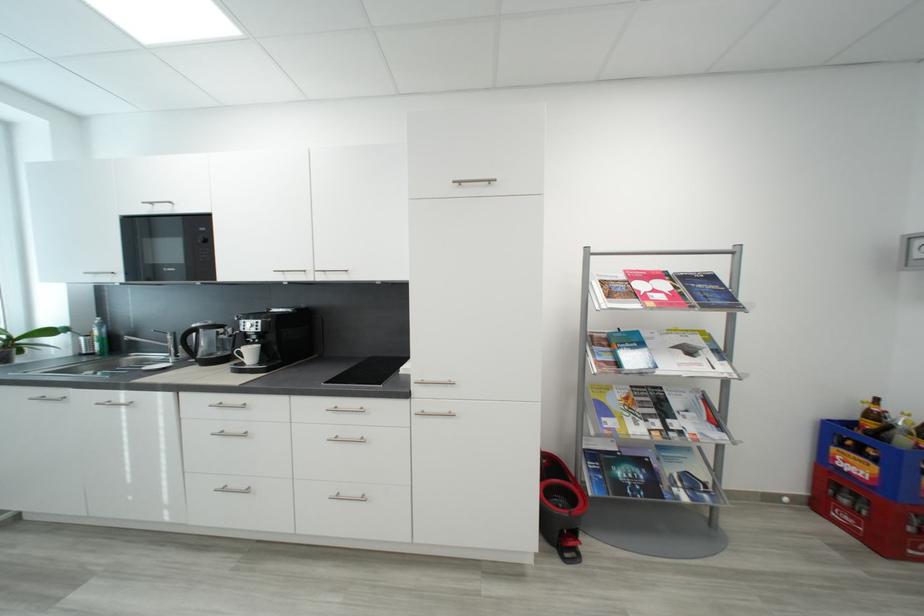
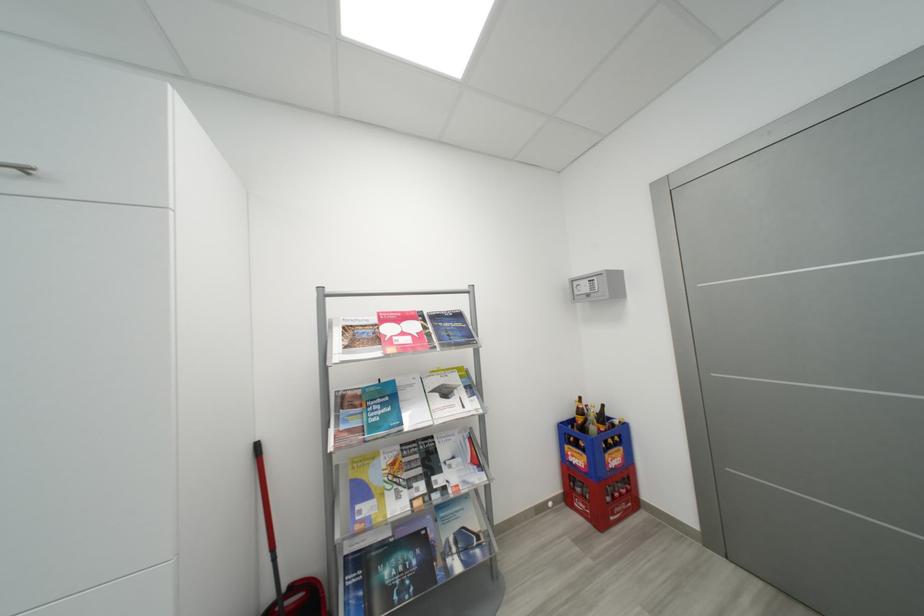
Question: The camera is either moving clockwise (left) or counter-clockwise (right) around the object. The first image is from the beginning of the video and the second image is from the end. Is the camera moving left or right when shooting the video?

Choices:
 (A) Left
 (B) Right

Answer: (A)